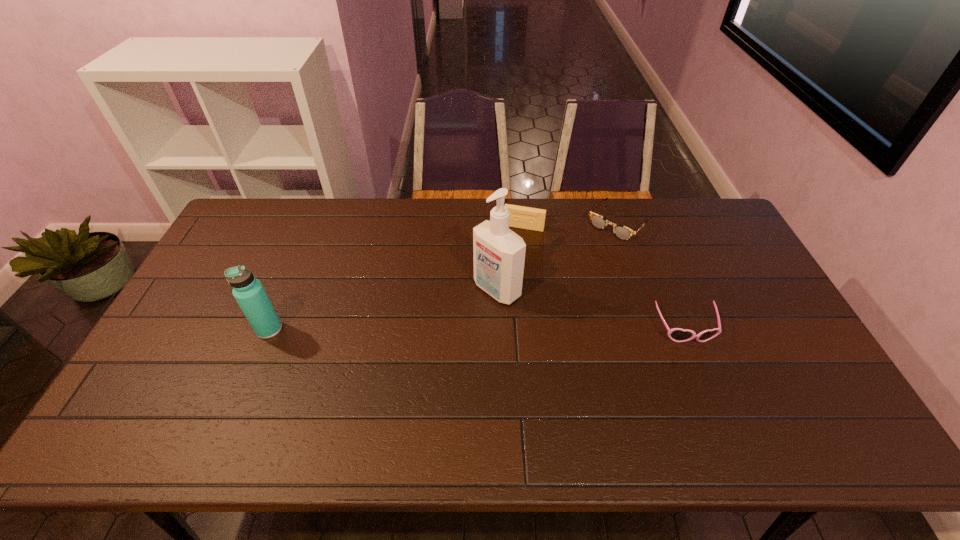
The height and width of the screenshot is (540, 960). What are the coordinates of `the second tallest object` in the screenshot? It's located at (248, 291).

I want to click on the leftmost object, so click(x=248, y=291).

Locate an element on the screen. Image resolution: width=960 pixels, height=540 pixels. sunglasses is located at coordinates (x=676, y=334).

Where is `the third tallest object`? The height and width of the screenshot is (540, 960). the third tallest object is located at coordinates (523, 217).

Where is `spectacles`? spectacles is located at coordinates (621, 232).

Where is `the third farthest object`? The height and width of the screenshot is (540, 960). the third farthest object is located at coordinates (499, 253).

Find the location of a particular element. This screenshot has height=540, width=960. cleansing agent is located at coordinates (499, 253).

Find the location of a particular element. free region located on the left of the leftmost object is located at coordinates (204, 329).

This screenshot has height=540, width=960. Find the location of `vacant position located on the front-facing side of the sunglasses`. vacant position located on the front-facing side of the sunglasses is located at coordinates (714, 403).

The height and width of the screenshot is (540, 960). Find the location of `vacant space situated 0.150m at the front of the videotape with spools`. vacant space situated 0.150m at the front of the videotape with spools is located at coordinates (511, 261).